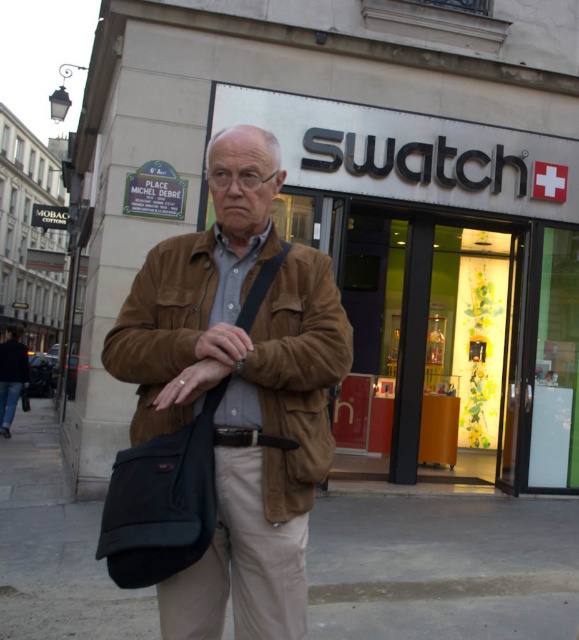
Which is more to the left, matte brown leather store at center or khaki cotton pants at center?

khaki cotton pants at center is more to the left.

Who is lower down, matte brown leather store at center or khaki cotton pants at center?

khaki cotton pants at center is below.

Identify the location of matte brown leather store at center. This screenshot has height=640, width=579. (364, 209).

Who is taller, brown suede jacket at center or khaki cotton pants at center?

brown suede jacket at center

Measure the distance between point (193, 323) and camera.

Point (193, 323) is 1.84 meters from camera.

This screenshot has height=640, width=579. Identify the location of brown suede jacket at center. (239, 392).

Can you confirm if matte brown leather store at center is positioned to the left of brown fabric bag at center?

Yes, matte brown leather store at center is to the left of brown fabric bag at center.

Is matte brown leather store at center in front of brown fabric bag at center?

Yes.

Is point (316, 61) positioned behind point (91, 556)?

Yes, point (316, 61) is farther from viewer.

In order to click on matte brown leather store at center in this screenshot , I will do click(x=364, y=209).